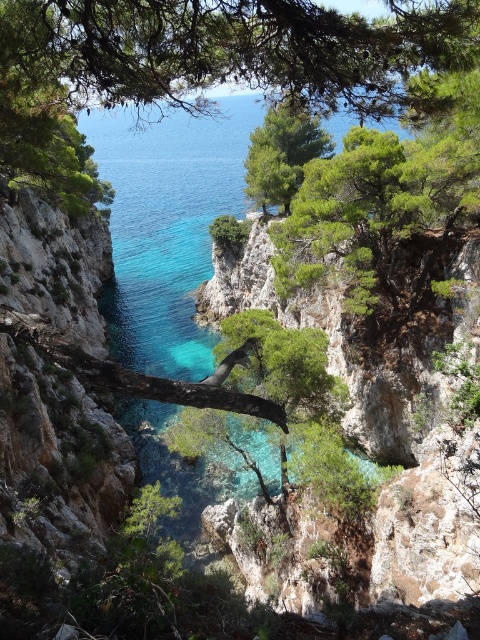
Which is above, green leafy tree at upper center or green leafy tree at center?

Positioned higher is green leafy tree at center.

Which of these two, green leafy tree at upper center or green leafy tree at center, stands shorter?

With less height is green leafy tree at upper center.

Between point (146, 49) and point (299, 125), which one is positioned in front?

Point (146, 49) is more forward.

What are the coordinates of `green leafy tree at upper center` in the screenshot? It's located at (229, 51).